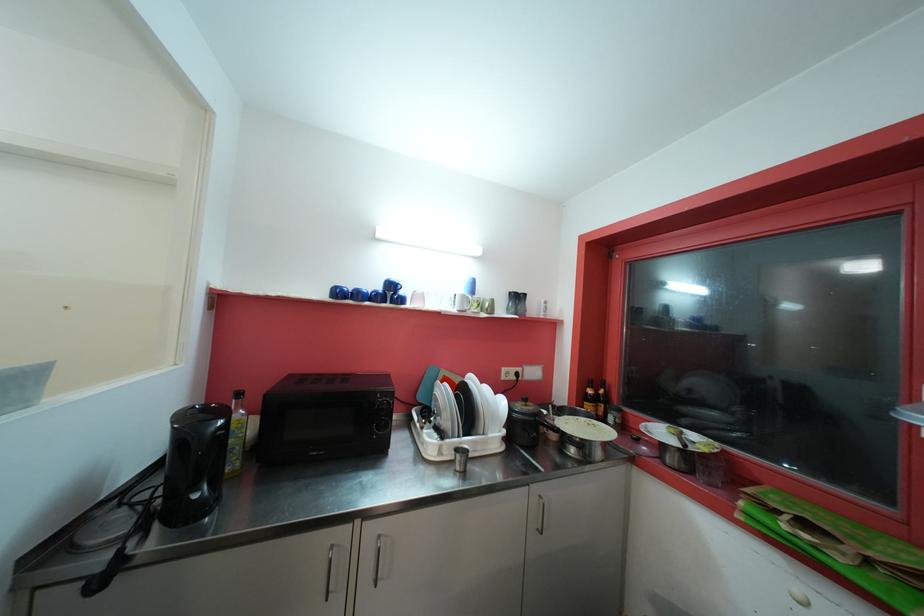
Where is `silver window handle`? The height and width of the screenshot is (616, 924). silver window handle is located at coordinates (380, 557).